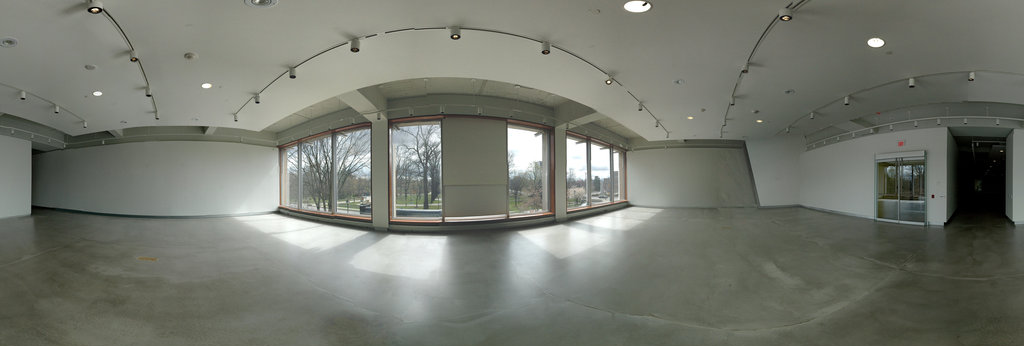
Where is `floor in front of left wall`? floor in front of left wall is located at coordinates (158, 225).